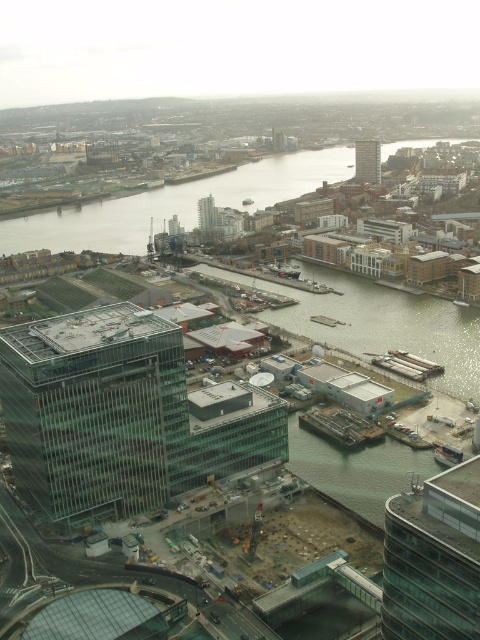
You are a drone operator flying over the city. You need to navigate between two points marked as point (48, 497) and point (359, 168). Which point is closer to your current position?

Point (48, 497) is closer to the viewer than point (359, 168), so the drone should navigate towards point (48, 497) first as it is nearer.

You are a city planner reviewing this area. You need to determine if the green concrete waterway at center can be used to transport materials to the glassy concrete building at upper right. Based on their positions, is this feasible?

The green concrete waterway at center is positioned under the glassy concrete building at upper right, so it is possible to transport materials via the waterway to the building as it is located beneath it.